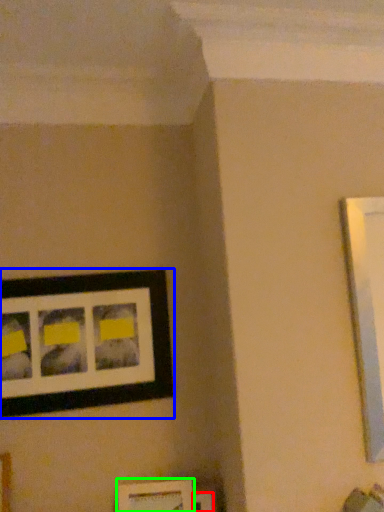
Question: Estimate the real-world distances between objects in this image. Which object is farther from picture frame (highlighted by a red box), picture frame (highlighted by a blue box) or picture frame (highlighted by a green box)?

Choices:
 (A) picture frame
 (B) picture frame

Answer: (A)